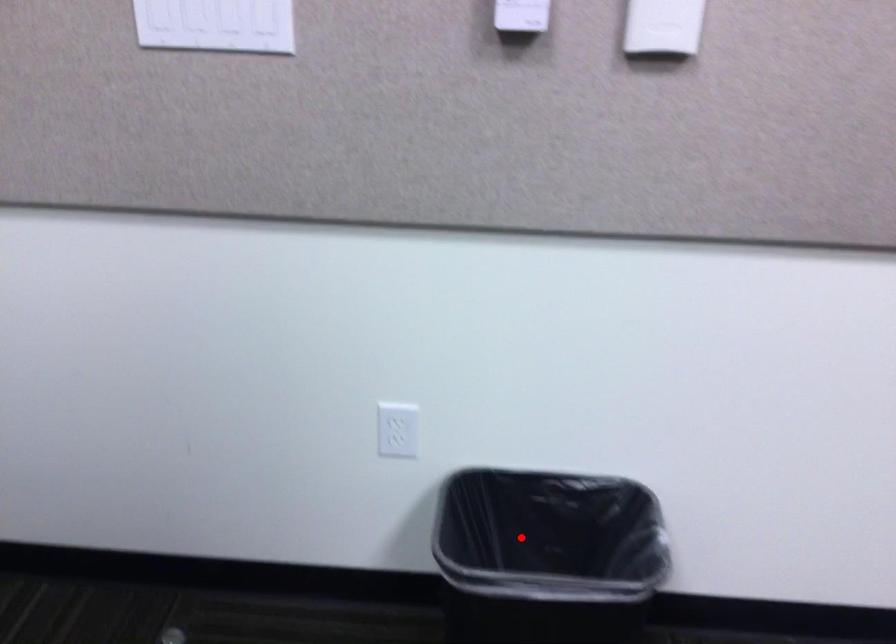
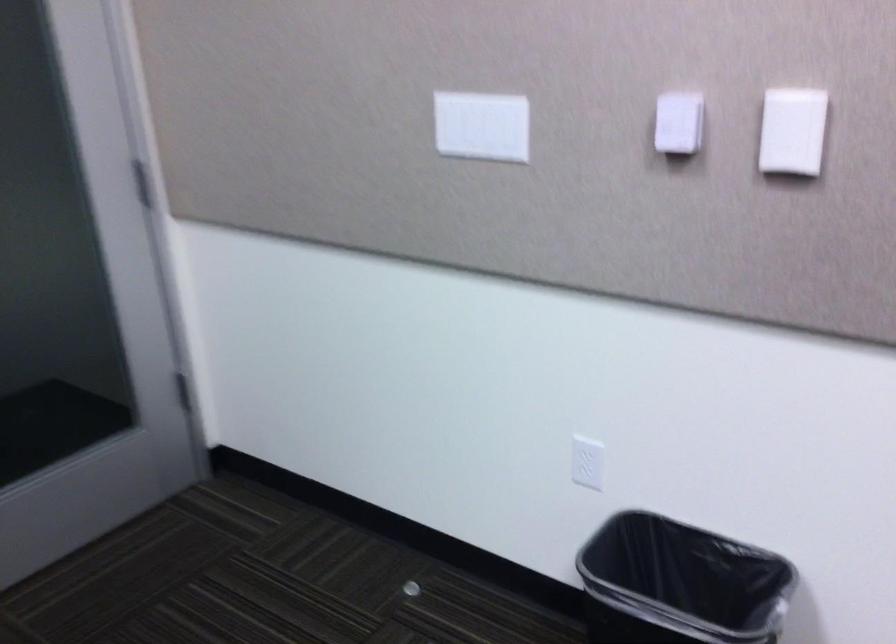
Question: I am providing you with two images of the same scene from different viewpoints. A red point is shown in image1. For the corresponding object point in image2, is it positioned nearer or farther from the camera?

Choices:
 (A) Nearer
 (B) Farther

Answer: (B)